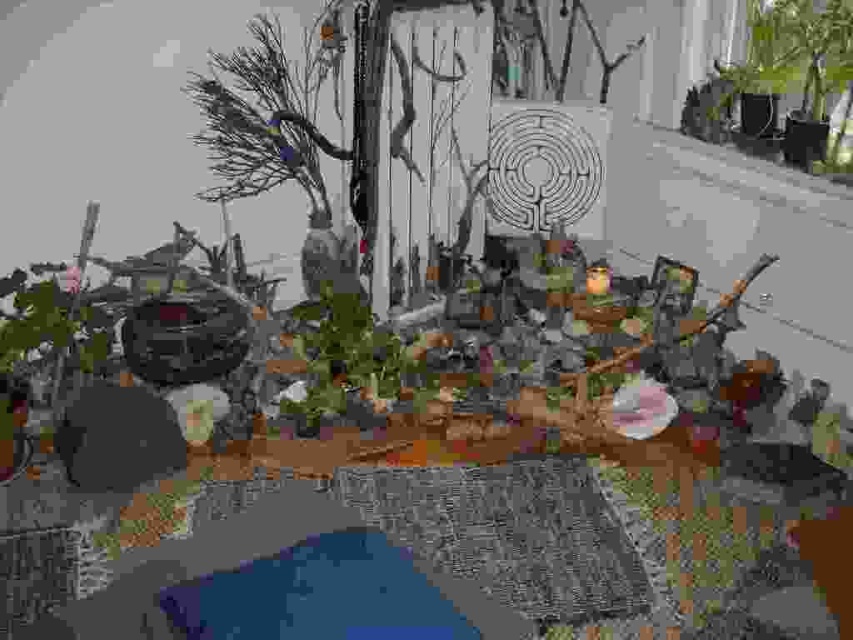
Which is behind, point (357, 323) or point (780, 1)?

Point (780, 1)

Which is below, green leafy plant at center or green matte plant at upper right?

green leafy plant at center

Find the location of a particular element. The width and height of the screenshot is (853, 640). green leafy plant at center is located at coordinates (351, 356).

Identify the location of green leafy plant at center. (351, 356).

Can you confirm if brown matte branch at upper left is taller than white concrete window sill at upper right?

Indeed, brown matte branch at upper left has a greater height compared to white concrete window sill at upper right.

Does brown matte branch at upper left appear over white concrete window sill at upper right?

Yes, brown matte branch at upper left is above white concrete window sill at upper right.

In the scene shown: Who is more distant from viewer, (254, 26) or (654, 148)?

Point (654, 148)

You are a GUI agent. You are given a task and a screenshot of the screen. Output one action in this format:
    pyautogui.click(x=<x>, y=<y>)
    Task: Click on the brown matte branch at upper left
    
    Given the screenshot: What is the action you would take?
    pyautogui.click(x=259, y=120)

Can you confirm if green leafy plant at center is bigger than white concrete window sill at upper right?

Incorrect, green leafy plant at center is not larger than white concrete window sill at upper right.

Can you confirm if green leafy plant at center is positioned to the left of white concrete window sill at upper right?

Yes, green leafy plant at center is to the left of white concrete window sill at upper right.

This screenshot has height=640, width=853. What do you see at coordinates (351, 356) in the screenshot?
I see `green leafy plant at center` at bounding box center [351, 356].

This screenshot has width=853, height=640. In order to click on green leafy plant at center in this screenshot , I will do `click(351, 356)`.